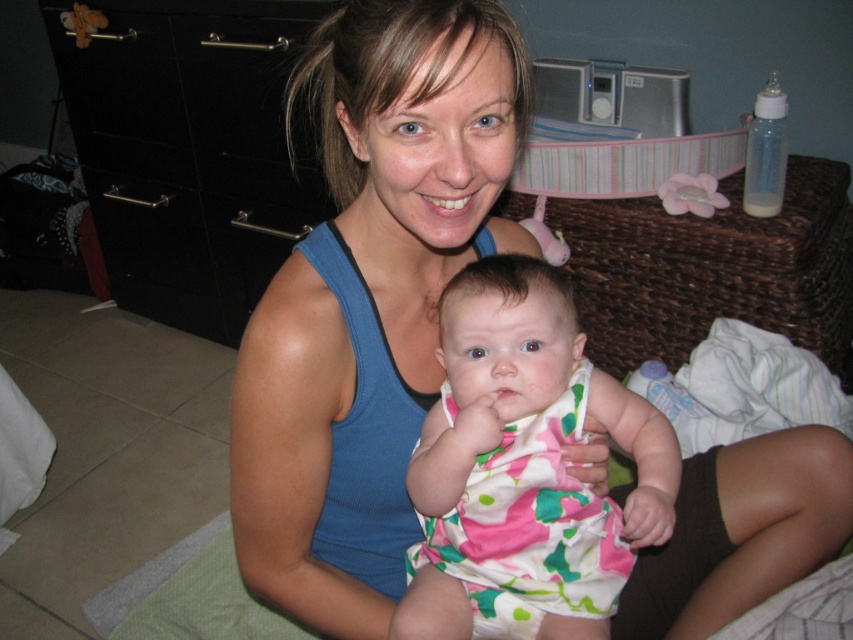
Question: Observing the image, what is the correct spatial positioning of blue fabric tank top at center in reference to floral fabric dress at center?

Choices:
 (A) below
 (B) above

Answer: (B)

Question: Estimate the real-world distances between objects in this image. Which object is farther from the floral fabric dress at center?

Choices:
 (A) blue fabric tank top at center
 (B) black glossy dresser at left

Answer: (B)

Question: Is black glossy dresser at left positioned in front of floral fabric dress at center?

Choices:
 (A) yes
 (B) no

Answer: (B)

Question: Among these objects, which one is farthest from the camera?

Choices:
 (A) black glossy dresser at left
 (B) floral fabric dress at center

Answer: (A)

Question: Which of these objects is positioned closest to the black glossy dresser at left?

Choices:
 (A) blue fabric tank top at center
 (B) floral fabric dress at center

Answer: (A)

Question: Considering the relative positions of blue fabric tank top at center and black glossy dresser at left in the image provided, where is blue fabric tank top at center located with respect to black glossy dresser at left?

Choices:
 (A) below
 (B) above

Answer: (A)